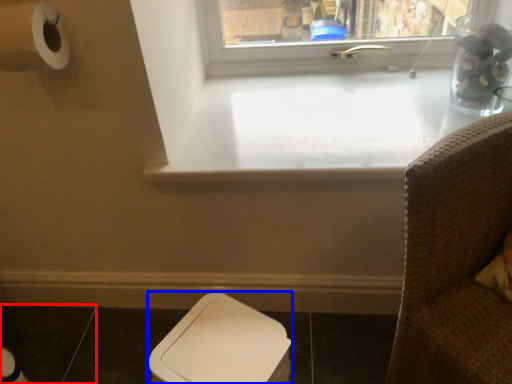
Question: Which object appears closest to the camera in this image, tile (highlighted by a red box) or toilet bowl (highlighted by a blue box)?

Choices:
 (A) tile
 (B) toilet bowl

Answer: (B)